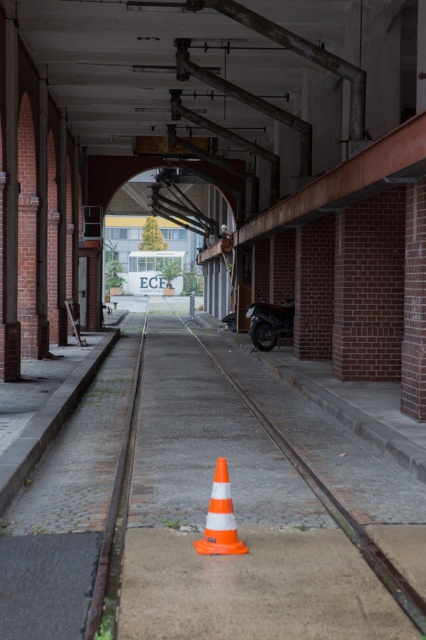
Who is more distant from viewer, (425, 605) or (227, 504)?

The point (227, 504) is behind.

Which is in front, point (362, 529) or point (206, 522)?

Point (206, 522) is in front.

Does point (333, 512) come closer to viewer compared to point (221, 548)?

That is False.

Where is `orange plastic train track at center`? Image resolution: width=426 pixels, height=640 pixels. orange plastic train track at center is located at coordinates (333, 508).

Can you confirm if orange plastic train track at center is positioned to the right of shiny black motorcycle at center?

No, orange plastic train track at center is not to the right of shiny black motorcycle at center.

Which is more to the left, orange plastic train track at center or shiny black motorcycle at center?

Positioned to the left is orange plastic train track at center.

Does point (227, 376) lie in front of point (279, 316)?

Yes, point (227, 376) is in front of point (279, 316).

Locate an element on the screen. orange plastic train track at center is located at coordinates (333, 508).

Can you confirm if orange/white striped traffic cone at center is thinner than shiny black motorcycle at center?

Correct, orange/white striped traffic cone at center's width is less than shiny black motorcycle at center's.

Is point (195, 540) in front of point (290, 326)?

That is True.

The image size is (426, 640). Identify the location of orange/white striped traffic cone at center. (219, 518).